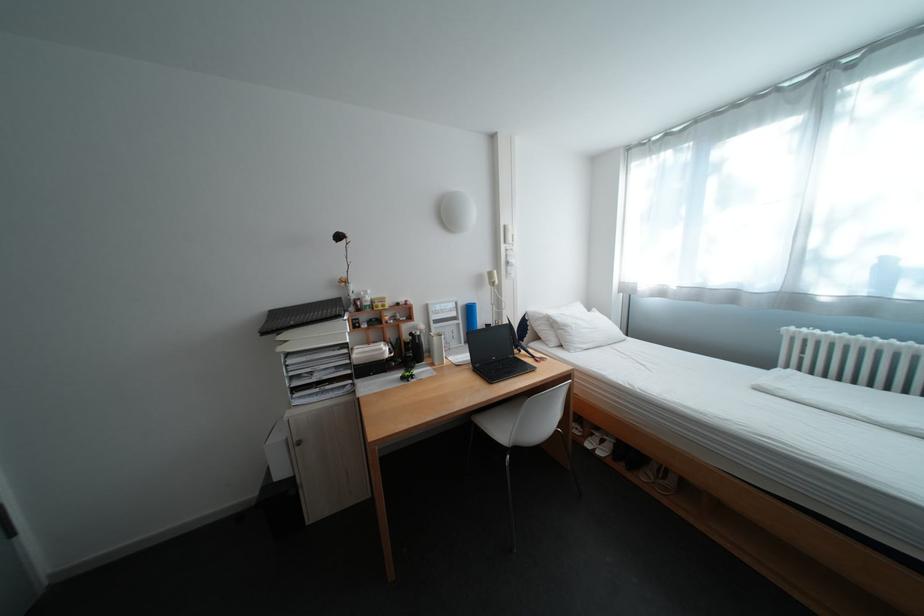
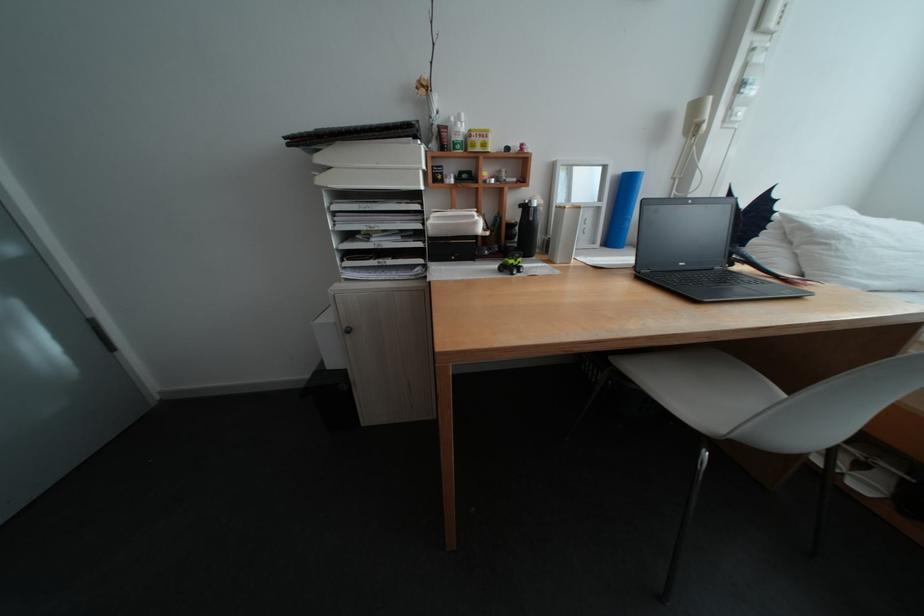
Find the pixel in the second image that matches (472,322) in the first image.

(616, 205)